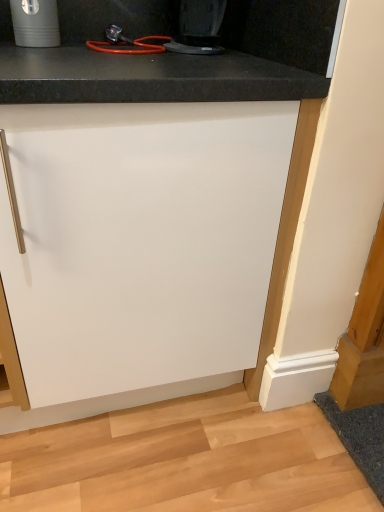
Question: Should I look upward or downward to see black plastic coffee maker at upper center?

Choices:
 (A) down
 (B) up

Answer: (B)

Question: Is matte black cup at upper left bigger than white matte cabinet at center?

Choices:
 (A) yes
 (B) no

Answer: (B)

Question: Is matte black cup at upper left to the right of white matte cabinet at center from the viewer's perspective?

Choices:
 (A) no
 (B) yes

Answer: (A)

Question: Is matte black cup at upper left thinner than white matte cabinet at center?

Choices:
 (A) yes
 (B) no

Answer: (A)

Question: From a real-world perspective, is matte black cup at upper left on top of white matte cabinet at center?

Choices:
 (A) no
 (B) yes

Answer: (B)

Question: Can you confirm if matte black cup at upper left is taller than white matte cabinet at center?

Choices:
 (A) no
 (B) yes

Answer: (A)

Question: Is matte black cup at upper left positioned behind white matte cabinet at center?

Choices:
 (A) no
 (B) yes

Answer: (B)

Question: Is matte black cup at upper left further to camera compared to black plastic coffee maker at upper center?

Choices:
 (A) yes
 (B) no

Answer: (A)

Question: Considering the relative sizes of matte black cup at upper left and black plastic coffee maker at upper center in the image provided, is matte black cup at upper left taller than black plastic coffee maker at upper center?

Choices:
 (A) yes
 (B) no

Answer: (A)

Question: Can you confirm if matte black cup at upper left is wider than black plastic coffee maker at upper center?

Choices:
 (A) yes
 (B) no

Answer: (B)

Question: Would you say matte black cup at upper left is outside black plastic coffee maker at upper center?

Choices:
 (A) yes
 (B) no

Answer: (A)

Question: From a real-world perspective, is matte black cup at upper left beneath black plastic coffee maker at upper center?

Choices:
 (A) no
 (B) yes

Answer: (A)

Question: Is matte black cup at upper left thinner than black plastic coffee maker at upper center?

Choices:
 (A) yes
 (B) no

Answer: (A)

Question: From the image's perspective, would you say white matte cabinet at center is positioned over black plastic coffee maker at upper center?

Choices:
 (A) no
 (B) yes

Answer: (A)